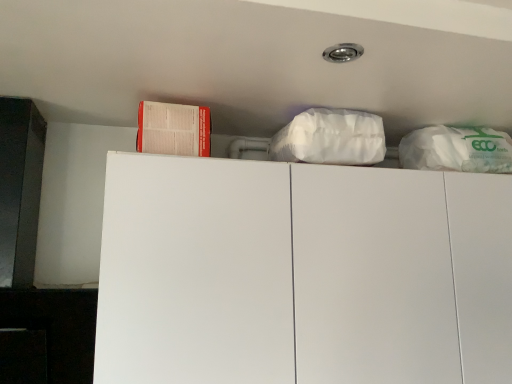
Question: Based on their sizes in the image, would you say red paper book at upper left is bigger or smaller than white matte cabinet at upper center?

Choices:
 (A) big
 (B) small

Answer: (B)

Question: From the image's perspective, is red paper book at upper left above or below white matte cabinet at upper center?

Choices:
 (A) below
 (B) above

Answer: (B)

Question: Would you say red paper book at upper left is to the left or to the right of white matte cabinet at upper center in the picture?

Choices:
 (A) left
 (B) right

Answer: (A)

Question: Is white matte cabinet at upper center in front of or behind red paper book at upper left in the image?

Choices:
 (A) front
 (B) behind

Answer: (A)

Question: Is white matte cabinet at upper center wider or thinner than red paper book at upper left?

Choices:
 (A) wide
 (B) thin

Answer: (A)

Question: Is point (101, 249) closer or farther from the camera than point (172, 125)?

Choices:
 (A) farther
 (B) closer

Answer: (B)

Question: From a real-world perspective, is white matte cabinet at upper center physically located above or below red paper book at upper left?

Choices:
 (A) above
 (B) below

Answer: (B)